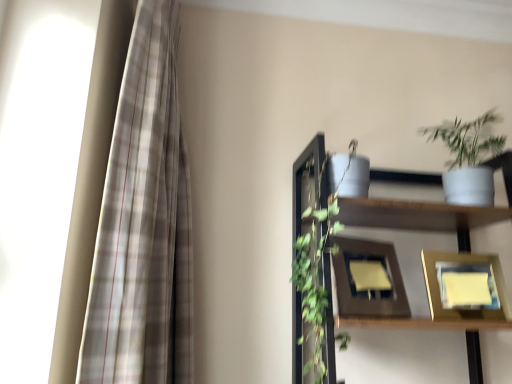
Question: Is wooden picture frame at center, the first picture frame when ordered from left to right, wider or thinner than white matte shelf at upper right?

Choices:
 (A) wide
 (B) thin

Answer: (B)

Question: Visually, is wooden picture frame at center, positioned as the second picture frame in right-to-left order, positioned to the left or to the right of white matte shelf at upper right?

Choices:
 (A) left
 (B) right

Answer: (A)

Question: Which object is the farthest from the gold metallic picture frame at lower right, positioned as the second picture frame in left-to-right order?

Choices:
 (A) white matte shelf at upper right
 (B) white matte pot at upper right
 (C) wooden picture frame at center, positioned as the second picture frame in right-to-left order
 (D) plaid fabric curtain at left

Answer: (D)

Question: Which is nearer to the gold metallic picture frame at lower right, which is the first picture frame in right-to-left order?

Choices:
 (A) plaid fabric curtain at left
 (B) wooden picture frame at center, the first picture frame when ordered from left to right
 (C) white matte pot at upper right
 (D) white matte shelf at upper right

Answer: (B)